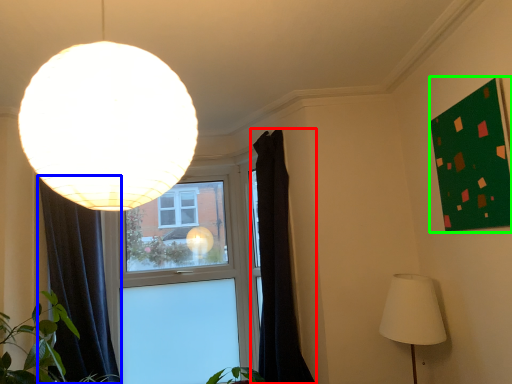
Question: Which object is positioned closest to curtain (highlighted by a red box)? Select from curtain (highlighted by a blue box) and bulletin board (highlighted by a green box).

Choices:
 (A) curtain
 (B) bulletin board

Answer: (B)